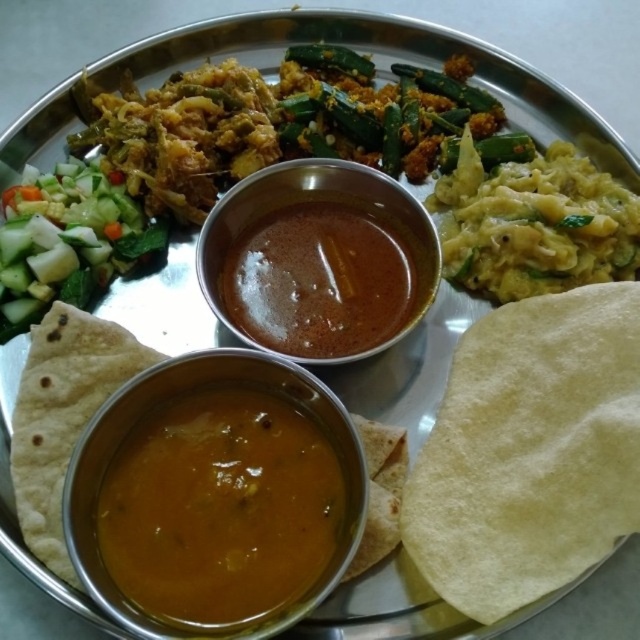
Question: Which of the following is the farthest from the observer?

Choices:
 (A) green crisp cucumber at left
 (B) yellow soft tortilla at lower right
 (C) brown thick sauce at center
 (D) brown creamy sauce at center

Answer: (A)

Question: Which point appears closest to the camera in this image?

Choices:
 (A) (336, 332)
 (B) (333, 500)
 (C) (490, 388)
 (D) (70, 196)

Answer: (B)

Question: From the image, what is the correct spatial relationship of yellow soft tortilla at lower right in relation to brown creamy sauce at center?

Choices:
 (A) above
 (B) below

Answer: (A)

Question: Observing the image, what is the correct spatial positioning of brown creamy sauce at center in reference to brown thick sauce at center?

Choices:
 (A) above
 (B) below

Answer: (B)

Question: Estimate the real-world distances between objects in this image. Which object is closer to the brown thick sauce at center?

Choices:
 (A) yellow soft tortilla at lower right
 (B) green crisp cucumber at left

Answer: (A)

Question: Does brown creamy sauce at center have a larger size compared to green crisp cucumber at left?

Choices:
 (A) yes
 (B) no

Answer: (B)